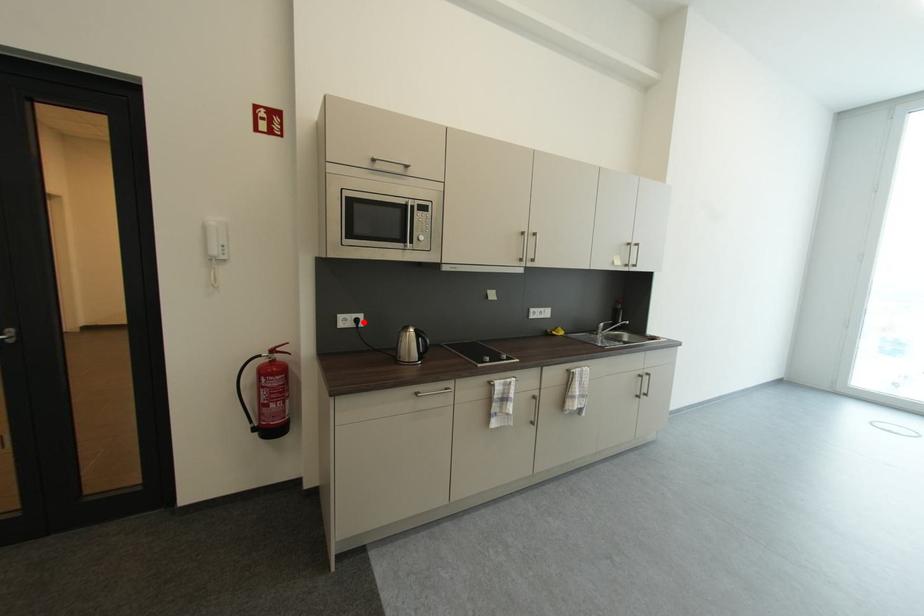
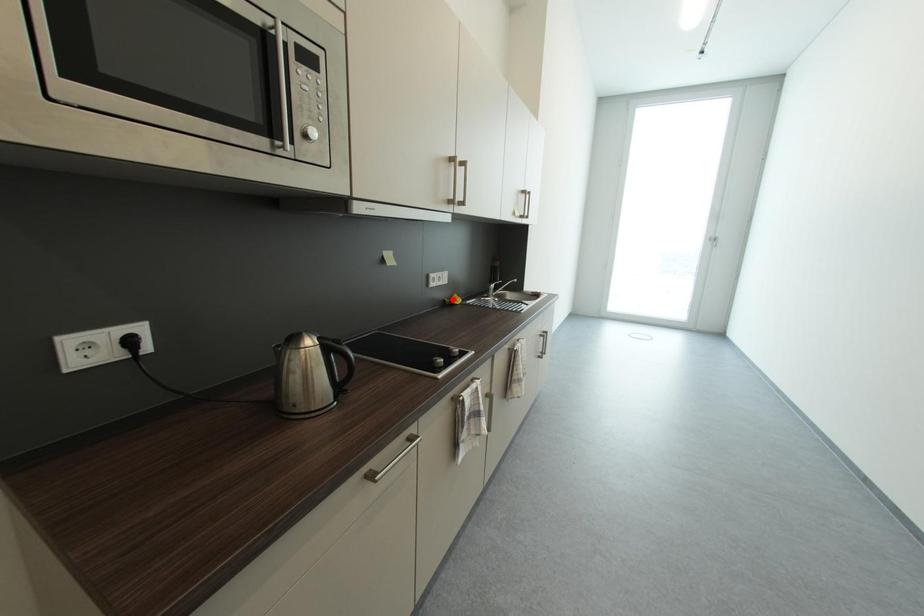
I am providing you with two images of the same scene from different viewpoints. A red point is marked on the first image and another point is marked on the second image. Do the highlighted points in image1 and image2 indicate the same real-world spot?

No